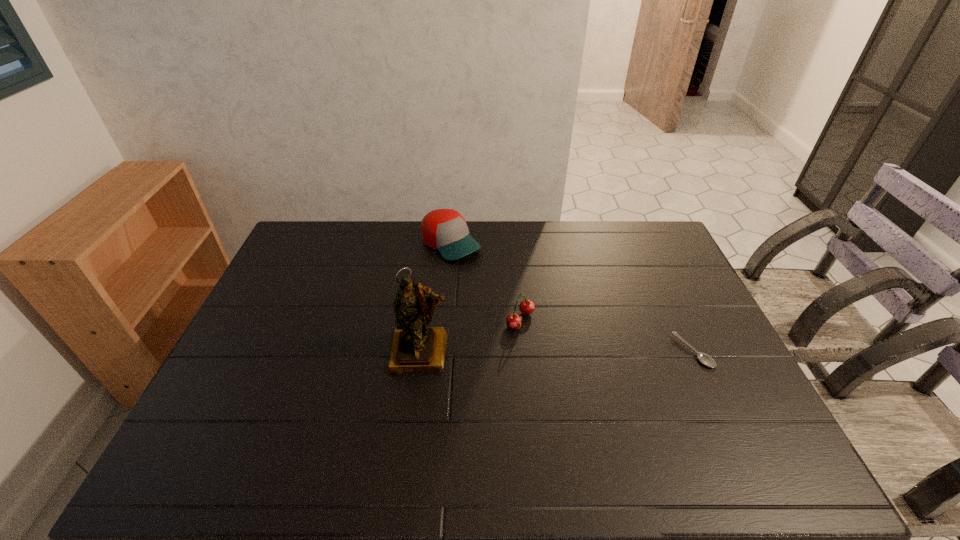
The width and height of the screenshot is (960, 540). What are the coordinates of `free space on the desktop that is between the tallest object and the rightmost object and is positioned at the brim of the farthest object` in the screenshot? It's located at (577, 352).

In order to click on free space on the desktop that is between the figurine and the soupspoon and is positioned with stems pointing upwards on the cherry in this screenshot , I will do `click(580, 352)`.